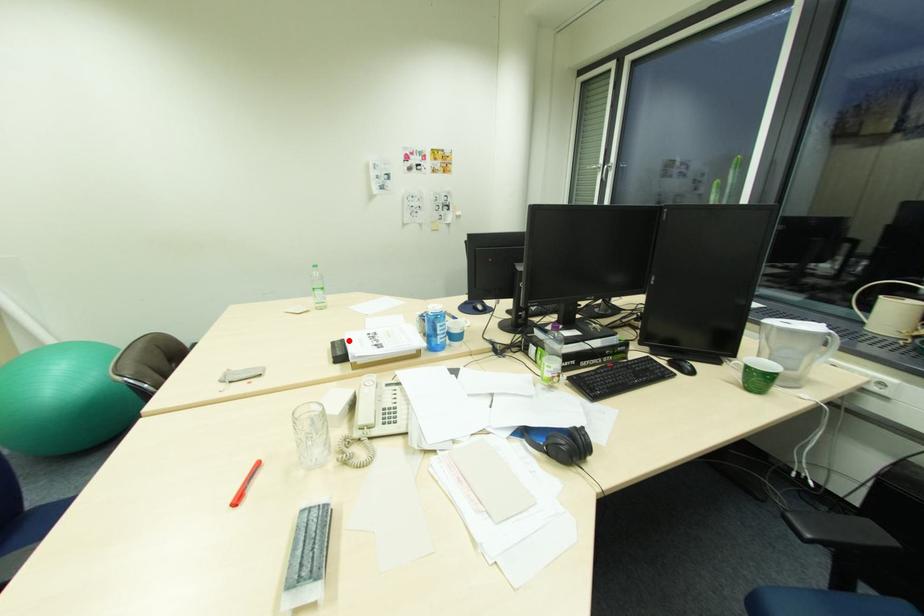
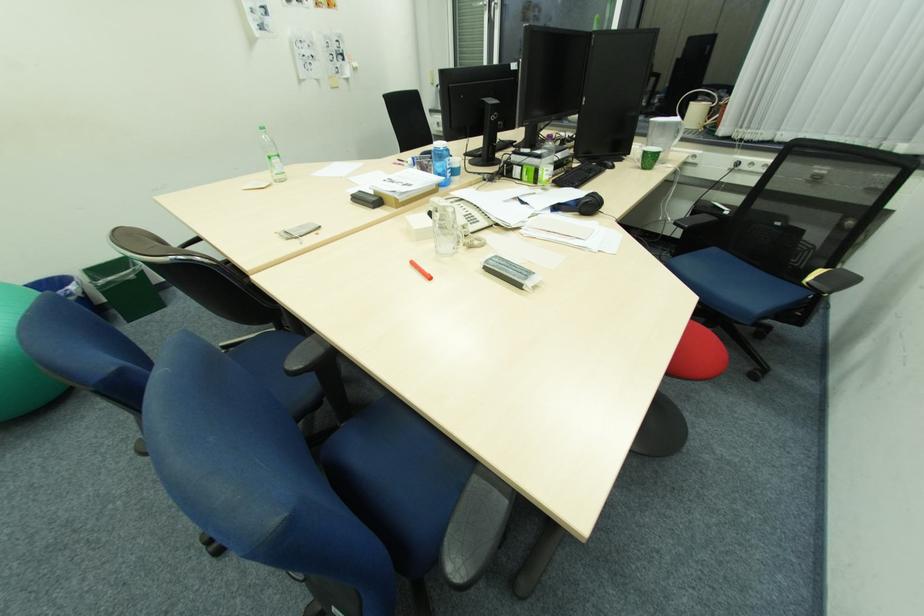
Question: I am providing you with two images of the same scene from different viewpoints. A red point is marked on the first image. Is the red point's position out of view in image 2?

Choices:
 (A) Yes
 (B) No

Answer: (B)